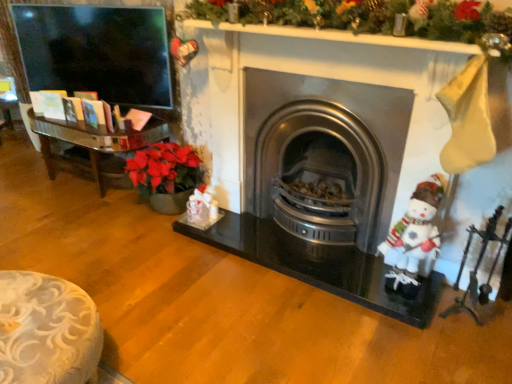
Where is `free space to the left of white fabric santa claus at right`? free space to the left of white fabric santa claus at right is located at coordinates (355, 311).